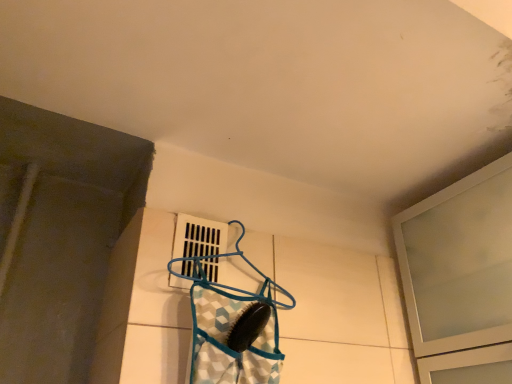
Measure the distance between point (192, 268) and camera.

Point (192, 268) and camera are 92.80 centimeters apart from each other.

You are a GUI agent. You are given a task and a screenshot of the screen. Output one action in this format:
    pyautogui.click(x=<x>, y=<y>)
    Task: Click on the frosted glass cabinet at upper right, the first window viewed from the right
    The image size is (512, 384).
    Given the screenshot: What is the action you would take?
    pyautogui.click(x=460, y=278)

In the scene shown: Is frosted glass cabinet at upper right, the first window viewed from the right, beside blue fabric bag at center?

They are not placed beside each other.

Is blue fabric bag at center completely or partially inside frosted glass cabinet at upper right, the first window viewed from the right?

That's incorrect, blue fabric bag at center is not inside frosted glass cabinet at upper right, the first window viewed from the right.

Based on the photo, does frosted glass cabinet at upper right, the second window when ordered from left to right, appear on the right side of blue fabric bag at center?

Yes, frosted glass cabinet at upper right, the second window when ordered from left to right, is to the right of blue fabric bag at center.

From a real-world perspective, who is located lower, blue plastic hanger at center or blue fabric bag at center?

From a 3D spatial view, blue fabric bag at center is below.

What's the angular difference between blue plastic hanger at center and blue fabric bag at center's facing directions?

They differ by 111 degrees in their facing directions.

Is blue plastic hanger at center facing away from blue fabric bag at center?

No, blue plastic hanger at center's orientation is not away from blue fabric bag at center.

Considering the relative sizes of blue plastic hanger at center and blue fabric bag at center in the image provided, is blue plastic hanger at center shorter than blue fabric bag at center?

No.

Locate an element on the screen. window lying on the right of blue plastic hanger at center is located at coordinates (460, 278).

From a real-world perspective, which object rests below the other?

frosted glass cabinet at upper right, the second window when ordered from left to right, from a real-world perspective.

Is blue plastic hanger at center completely or partially outside of frosted glass cabinet at upper right, the second window when ordered from left to right?

Yes, blue plastic hanger at center is not within frosted glass cabinet at upper right, the second window when ordered from left to right.

From the image's perspective, is blue plastic hanger at center located above or below frosted glass cabinet at upper right, the first window viewed from the right?

Based on their image positions, blue plastic hanger at center is located above frosted glass cabinet at upper right, the first window viewed from the right.

Is blue fabric bag at center in front of or behind white plastic vent at center, which is the 2th window in right-to-left order, in the image?

Visually, blue fabric bag at center is located in front of white plastic vent at center, which is the 2th window in right-to-left order.

How many degrees apart are the facing directions of blue fabric bag at center and white plastic vent at center, which is the 2th window in right-to-left order?

The facing directions of blue fabric bag at center and white plastic vent at center, which is the 2th window in right-to-left order, are 113 degrees apart.

From their relative heights in the image, would you say blue fabric bag at center is taller or shorter than white plastic vent at center, which is the 2th window in right-to-left order?

Considering their sizes, blue fabric bag at center has more height than white plastic vent at center, which is the 2th window in right-to-left order.

Is white plastic vent at center, the 1th window viewed from the left, facing towards blue plastic hanger at center?

Yes, white plastic vent at center, the 1th window viewed from the left, is turned towards blue plastic hanger at center.

From their relative heights in the image, would you say white plastic vent at center, which is the 2th window in right-to-left order, is taller or shorter than blue plastic hanger at center?

Clearly, white plastic vent at center, which is the 2th window in right-to-left order, is shorter compared to blue plastic hanger at center.

Which is behind, point (205, 233) or point (193, 271)?

Positioned behind is point (205, 233).

From a real-world perspective, between white plastic vent at center, the 1th window viewed from the left, and blue plastic hanger at center, who is vertically lower?

white plastic vent at center, the 1th window viewed from the left.

Consider the image. Is white plastic vent at center, which is the 2th window in right-to-left order, facing away from blue fabric bag at center?

No, white plastic vent at center, which is the 2th window in right-to-left order,'s orientation is not away from blue fabric bag at center.

Is white plastic vent at center, which is the 2th window in right-to-left order, thinner than blue fabric bag at center?

Yes, white plastic vent at center, which is the 2th window in right-to-left order, is thinner than blue fabric bag at center.

Is white plastic vent at center, which is the 2th window in right-to-left order, bigger than blue fabric bag at center?

Actually, white plastic vent at center, which is the 2th window in right-to-left order, might be smaller than blue fabric bag at center.

From the image's perspective, is white plastic vent at center, which is the 2th window in right-to-left order, over blue fabric bag at center?

Indeed, from the image's perspective, white plastic vent at center, which is the 2th window in right-to-left order, is shown above blue fabric bag at center.

Is point (207, 221) farther from viewer compared to point (469, 279)?

That is True.

Are white plastic vent at center, the 1th window viewed from the left, and frosted glass cabinet at upper right, the first window viewed from the right, making contact?

No, white plastic vent at center, the 1th window viewed from the left, is not beside frosted glass cabinet at upper right, the first window viewed from the right.

Considering the relative sizes of white plastic vent at center, the 1th window viewed from the left, and frosted glass cabinet at upper right, the first window viewed from the right, in the image provided, is white plastic vent at center, the 1th window viewed from the left, bigger than frosted glass cabinet at upper right, the first window viewed from the right,?

No, white plastic vent at center, the 1th window viewed from the left, is not bigger than frosted glass cabinet at upper right, the first window viewed from the right.

The image size is (512, 384). I want to click on window in front of the white plastic vent at center, which is the 2th window in right-to-left order, so click(460, 278).

The image size is (512, 384). I want to click on the 1st window positioned above the blue fabric bag at center (from the image's perspective), so click(460, 278).

Where is `clothing that appears below the blue plastic hanger at center (from the image's perspective)`? The width and height of the screenshot is (512, 384). clothing that appears below the blue plastic hanger at center (from the image's perspective) is located at coordinates (231, 339).

When comparing their distances from blue fabric bag at center, does white plastic vent at center, which is the 2th window in right-to-left order, or blue plastic hanger at center seem further?

Among the two, white plastic vent at center, which is the 2th window in right-to-left order, is located further to blue fabric bag at center.

Consider the image. When comparing their distances from blue plastic hanger at center, does frosted glass cabinet at upper right, the first window viewed from the right, or blue fabric bag at center seem further?

frosted glass cabinet at upper right, the first window viewed from the right, lies further to blue plastic hanger at center than the other object.

Considering their positions, is frosted glass cabinet at upper right, the first window viewed from the right, positioned closer to white plastic vent at center, the 1th window viewed from the left, than blue fabric bag at center?

blue fabric bag at center lies closer to white plastic vent at center, the 1th window viewed from the left, than the other object.

When comparing their distances from frosted glass cabinet at upper right, the second window when ordered from left to right, does blue fabric bag at center or blue plastic hanger at center seem further?

blue fabric bag at center is further to frosted glass cabinet at upper right, the second window when ordered from left to right.

Which object lies further to the anchor point frosted glass cabinet at upper right, the first window viewed from the right, white plastic vent at center, the 1th window viewed from the left, or blue fabric bag at center?

white plastic vent at center, the 1th window viewed from the left.

Based on their spatial positions, is blue plastic hanger at center or blue fabric bag at center further from white plastic vent at center, which is the 2th window in right-to-left order?

blue fabric bag at center lies further to white plastic vent at center, which is the 2th window in right-to-left order, than the other object.

Considering their positions, is blue plastic hanger at center positioned further to frosted glass cabinet at upper right, the first window viewed from the right, than white plastic vent at center, which is the 2th window in right-to-left order?

Among the two, white plastic vent at center, which is the 2th window in right-to-left order, is located further to frosted glass cabinet at upper right, the first window viewed from the right.

Based on their spatial positions, is frosted glass cabinet at upper right, the first window viewed from the right, or white plastic vent at center, the 1th window viewed from the left, further from blue fabric bag at center?

Among the two, frosted glass cabinet at upper right, the first window viewed from the right, is located further to blue fabric bag at center.

Locate an element on the screen. hanger positioned between blue fabric bag at center and white plastic vent at center, which is the 2th window in right-to-left order, from near to far is located at coordinates (223, 257).

Locate an element on the screen. The height and width of the screenshot is (384, 512). clothing between white plastic vent at center, which is the 2th window in right-to-left order, and frosted glass cabinet at upper right, the second window when ordered from left to right, from left to right is located at coordinates (231, 339).

You are a GUI agent. You are given a task and a screenshot of the screen. Output one action in this format:
    pyautogui.click(x=<x>, y=<y>)
    Task: Click on the hanger between white plastic vent at center, the 1th window viewed from the left, and frosted glass cabinet at upper right, the first window viewed from the right
    
    Given the screenshot: What is the action you would take?
    pyautogui.click(x=223, y=257)

You are a GUI agent. You are given a task and a screenshot of the screen. Output one action in this format:
    pyautogui.click(x=<x>, y=<y>)
    Task: Click on the clothing between blue plastic hanger at center and frosted glass cabinet at upper right, the second window when ordered from left to right, in the horizontal direction
    
    Given the screenshot: What is the action you would take?
    pyautogui.click(x=231, y=339)